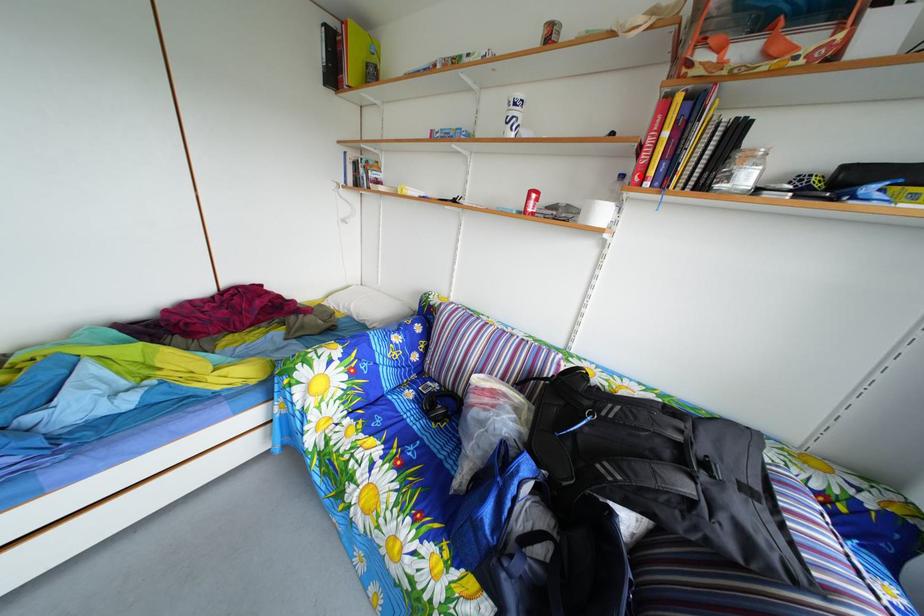
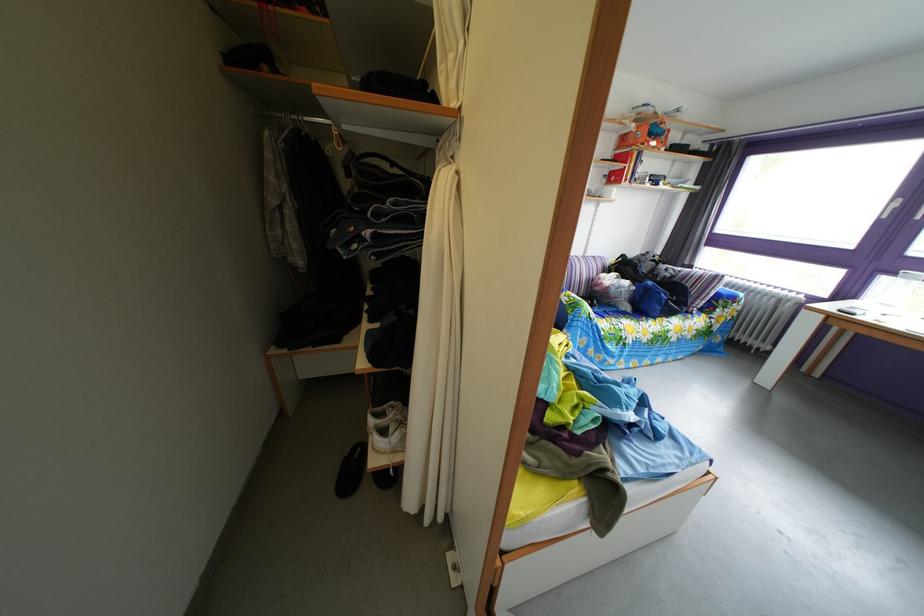
Locate, in the second image, the point that corresponds to the highlighted location in the first image.

(618, 180)